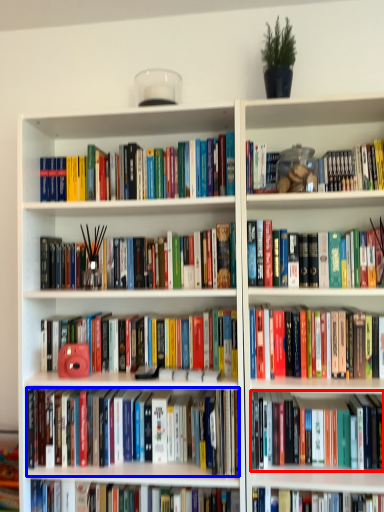
Question: Which of the following is the farthest to the observer, book (highlighted by a red box) or book (highlighted by a blue box)?

Choices:
 (A) book
 (B) book

Answer: (B)